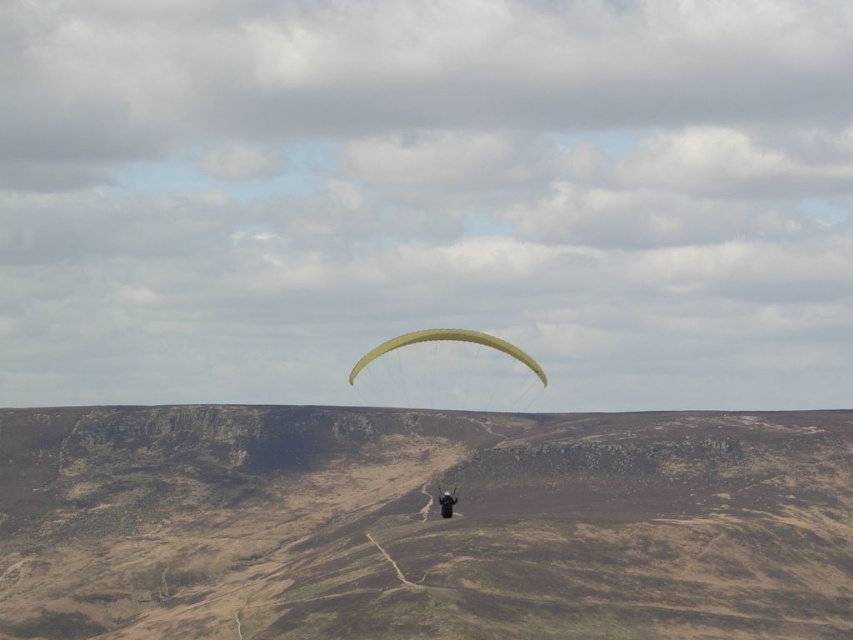
Between yellow fabric parachute at center and black fabric person at center, which one has less height?

black fabric person at center

Can you confirm if yellow fabric parachute at center is shorter than black fabric person at center?

No, yellow fabric parachute at center is not shorter than black fabric person at center.

Does point (509, 355) come farther from viewer compared to point (440, 496)?

That is True.

Locate an element on the screen. The image size is (853, 640). yellow fabric parachute at center is located at coordinates (447, 340).

Who is more distant from viewer, (x=38, y=451) or (x=451, y=515)?

The point (x=38, y=451) is more distant.

Does brown textured hillside at center come in front of black fabric person at center?

Yes, brown textured hillside at center is in front of black fabric person at center.

Does point (773, 560) come in front of point (445, 504)?

No, (773, 560) is further to viewer.

Identify the location of brown textured hillside at center. Image resolution: width=853 pixels, height=640 pixels. (422, 524).

Based on the photo, does brown textured hillside at center have a greater width compared to yellow fabric parachute at center?

Yes, brown textured hillside at center is wider than yellow fabric parachute at center.

Can you confirm if brown textured hillside at center is positioned below yellow fabric parachute at center?

Yes.

You are a GUI agent. You are given a task and a screenshot of the screen. Output one action in this format:
    pyautogui.click(x=<x>, y=<y>)
    Task: Click on the brown textured hillside at center
    
    Given the screenshot: What is the action you would take?
    pyautogui.click(x=422, y=524)

Locate an element on the screen. brown textured hillside at center is located at coordinates (422, 524).